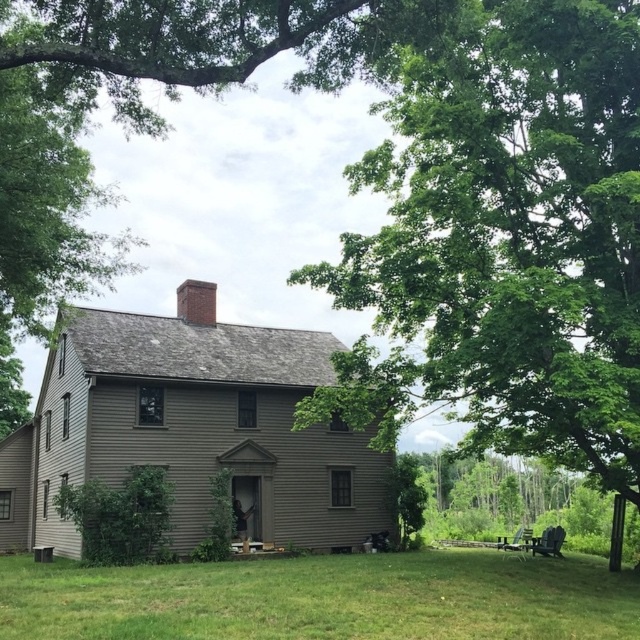
Question: Which of the following is the farthest from the observer?

Choices:
 (A) (76, 632)
 (B) (200, 298)
 (C) (461, 227)

Answer: (B)

Question: Is green grass at lower center closer to the viewer compared to red brick chimney at upper center?

Choices:
 (A) no
 (B) yes

Answer: (B)

Question: Estimate the real-world distances between objects in this image. Which object is closer to the green leafy tree at center?

Choices:
 (A) green grass at lower center
 (B) red brick chimney at upper center

Answer: (A)

Question: Considering the real-world distances, which object is closest to the green grass at lower center?

Choices:
 (A) red brick chimney at upper center
 (B) green leafy tree at center

Answer: (B)

Question: Is green leafy tree at center wider than green grass at lower center?

Choices:
 (A) yes
 (B) no

Answer: (B)

Question: Can you confirm if green leafy tree at center is bigger than green grass at lower center?

Choices:
 (A) no
 (B) yes

Answer: (B)